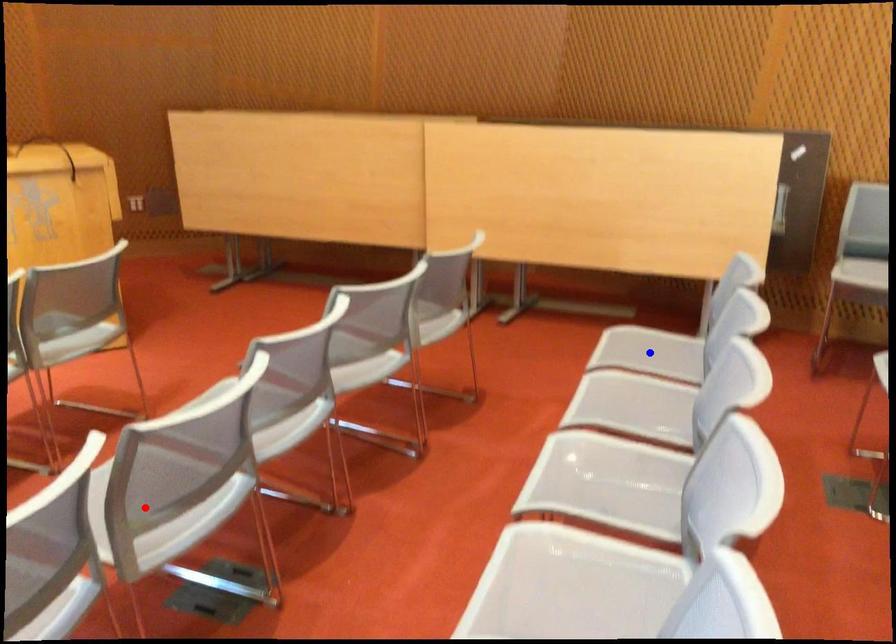
Question: Two points are marked on the image. Which point is closer to the camera?

Choices:
 (A) Blue point is closer.
 (B) Red point is closer.

Answer: (B)